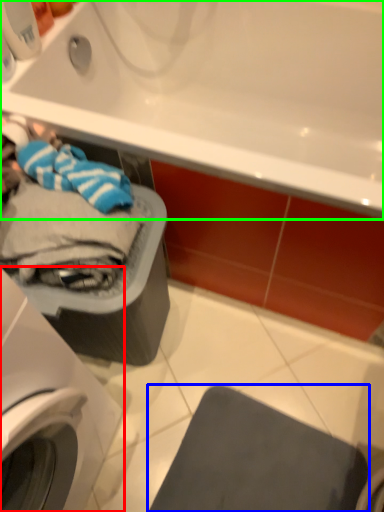
Question: Which object is the closest to the washing machine (highlighted by a red box)? Choose among these: gray (highlighted by a blue box) or bathtub (highlighted by a green box).

Choices:
 (A) gray
 (B) bathtub

Answer: (A)